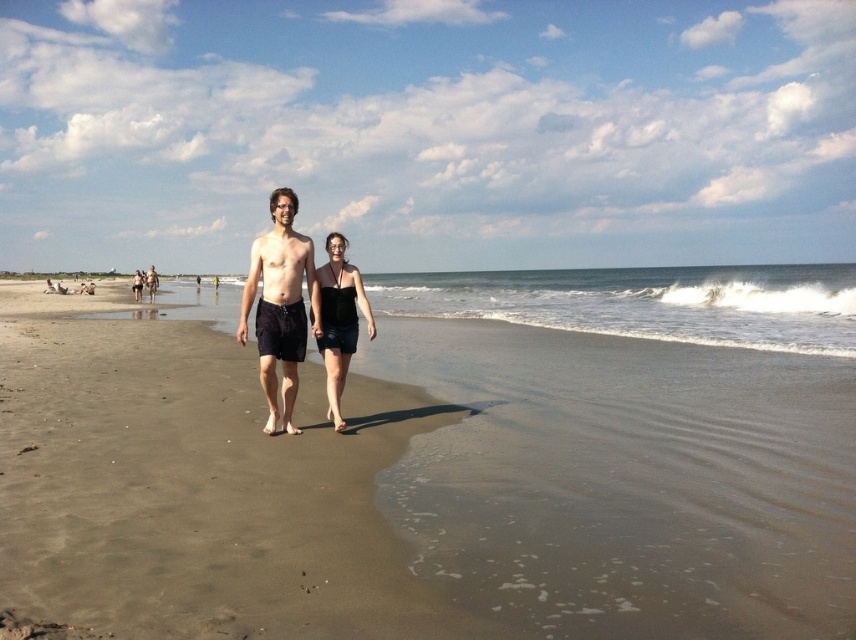
Which is above, dark blue shorts at center or matte black shorts at center?

Positioned higher is matte black shorts at center.

Between dark blue shorts at center and matte black shorts at center, which one appears on the right side from the viewer's perspective?

dark blue shorts at center is more to the right.

Find the location of a particular element. dark blue shorts at center is located at coordinates (280, 305).

At what (x,y) coordinates should I click in order to perform the action: click on dark blue shorts at center. Please return your answer as a coordinate pair (x, y). This screenshot has height=640, width=856. Looking at the image, I should click on (280, 305).

Does dark blue shorts at center appear on the left side of black matte dress at center?

Yes, dark blue shorts at center is to the left of black matte dress at center.

Describe the element at coordinates (280, 305) in the screenshot. The image size is (856, 640). I see `dark blue shorts at center` at that location.

Locate an element on the screen. dark blue shorts at center is located at coordinates (280, 305).

Does smooth sand at center have a greater height compared to dark blue shorts at center?

In fact, smooth sand at center may be shorter than dark blue shorts at center.

Between point (39, 515) and point (277, 278), which one is positioned in front?

Point (39, 515) is more forward.

Where is `smooth sand at center`? smooth sand at center is located at coordinates (424, 484).